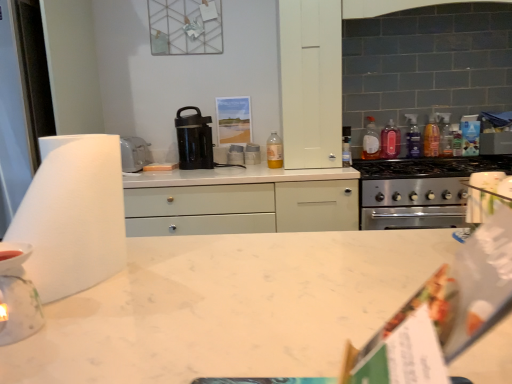
How much space does translucent plastic bottle at upper right, the 2th bottle when ordered from left to right, occupy vertically?

translucent plastic bottle at upper right, the 2th bottle when ordered from left to right, is 10.37 inches tall.

I want to click on translucent plastic bottle at upper center, positioned as the fifth bottle in right-to-left order, so click(x=274, y=151).

What do you see at coordinates (17, 296) in the screenshot? The image size is (512, 384). I see `porcelain tea light holder at lower left, which appears as the first appliance when ordered from the bottom` at bounding box center [17, 296].

The width and height of the screenshot is (512, 384). Find the location of `white glossy stack of plates at center, the first appliance from the right`. white glossy stack of plates at center, the first appliance from the right is located at coordinates (252, 154).

This screenshot has width=512, height=384. Describe the element at coordinates (390, 141) in the screenshot. I see `translucent plastic bottle at upper right, acting as the 3th bottle starting from the right` at that location.

You are a GUI agent. You are given a task and a screenshot of the screen. Output one action in this format:
    pyautogui.click(x=<x>, y=<y>)
    Task: Click on the translucent plastic bottle at upper right, the 4th bottle in the right-to-left sequence
    
    Given the screenshot: What is the action you would take?
    pyautogui.click(x=371, y=141)

Which is behind, point (414, 115) or point (25, 296)?

The point (414, 115) is behind.

Considering the relative positions of translucent plastic bottle at stove top, the 4th bottle in the left-to-right sequence, and porcelain tea light holder at lower left, which is the second appliance from right to left, in the image provided, is translucent plastic bottle at stove top, the 4th bottle in the left-to-right sequence, behind porcelain tea light holder at lower left, which is the second appliance from right to left,?

Yes, it is behind porcelain tea light holder at lower left, which is the second appliance from right to left.

Do you think translucent plastic bottle at stove top, positioned as the second bottle in right-to-left order, is within porcelain tea light holder at lower left, which is the second appliance from right to left, or outside of it?

translucent plastic bottle at stove top, positioned as the second bottle in right-to-left order, is not inside porcelain tea light holder at lower left, which is the second appliance from right to left, it's outside.

Which of these two, translucent plastic bottle at stove top, positioned as the second bottle in right-to-left order, or porcelain tea light holder at lower left, which appears as the 2th appliance when viewed from the left, is wider?

Wider between the two is porcelain tea light holder at lower left, which appears as the 2th appliance when viewed from the left.

Is stainless steel stove at right completely or partially outside of white glossy stack of plates at center, the first appliance from the right?

That's correct, stainless steel stove at right is outside of white glossy stack of plates at center, the first appliance from the right.

In the scene shown: Between stainless steel stove at right and white glossy stack of plates at center, the first appliance from the right, which one is positioned behind?

white glossy stack of plates at center, the first appliance from the right, is further away from the camera.

Which is in front, point (378, 173) or point (249, 160)?

The point (378, 173) is closer to the camera.

Can you tell me how much porcelain tea light holder at lower left, marked as the 3th appliance in a top-to-bottom arrangement, and translucent plastic bottle at stove top, the 4th bottle in the left-to-right sequence, differ in facing direction?

The angle between the facing direction of porcelain tea light holder at lower left, marked as the 3th appliance in a top-to-bottom arrangement, and the facing direction of translucent plastic bottle at stove top, the 4th bottle in the left-to-right sequence, is 89.7 degrees.

Is the surface of porcelain tea light holder at lower left, marked as the 3th appliance in a top-to-bottom arrangement, in direct contact with translucent plastic bottle at stove top, the 4th bottle in the left-to-right sequence?

porcelain tea light holder at lower left, marked as the 3th appliance in a top-to-bottom arrangement, is not next to translucent plastic bottle at stove top, the 4th bottle in the left-to-right sequence, and they're not touching.

Between point (39, 314) and point (409, 155), which one is positioned behind?

The point (409, 155) is more distant.

Looking at this image, from their relative heights in the image, would you say porcelain tea light holder at lower left, which appears as the first appliance when ordered from the bottom, is taller or shorter than translucent plastic bottle at stove top, the 4th bottle in the left-to-right sequence?

In the image, porcelain tea light holder at lower left, which appears as the first appliance when ordered from the bottom, appears to be shorter than translucent plastic bottle at stove top, the 4th bottle in the left-to-right sequence.

Can you tell me how much translucent plastic bottle at upper right, the third bottle positioned from the left, and white matte cabinet at upper center differ in facing direction?

The facing directions of translucent plastic bottle at upper right, the third bottle positioned from the left, and white matte cabinet at upper center are 0.0218 degrees apart.

The width and height of the screenshot is (512, 384). In order to click on cabinetry in front of the translucent plastic bottle at upper right, acting as the 3th bottle starting from the right in this screenshot , I will do `click(311, 82)`.

Is point (394, 143) in front of point (315, 67)?

That is False.

What's the angular difference between translucent plastic bottle at upper center, positioned as the fifth bottle in right-to-left order, and translucent plastic bottles at upper right, arranged as the 5th bottle when viewed from the left,'s facing directions?

The facing directions of translucent plastic bottle at upper center, positioned as the fifth bottle in right-to-left order, and translucent plastic bottles at upper right, arranged as the 5th bottle when viewed from the left, are 0.312 degrees apart.

Is translucent plastic bottle at upper center, positioned as the fifth bottle in right-to-left order, wider than translucent plastic bottles at upper right, marked as the first bottle in a right-to-left arrangement?

In fact, translucent plastic bottle at upper center, positioned as the fifth bottle in right-to-left order, might be narrower than translucent plastic bottles at upper right, marked as the first bottle in a right-to-left arrangement.

Is point (272, 143) positioned behind point (429, 119)?

Yes, it is.

Could you tell me if translucent plastic bottle at upper center, which is the 1th bottle from left to right, is facing translucent plastic bottles at upper right, arranged as the 5th bottle when viewed from the left?

No, translucent plastic bottle at upper center, which is the 1th bottle from left to right, is not turned towards translucent plastic bottles at upper right, arranged as the 5th bottle when viewed from the left.

Would you say porcelain tea light holder at lower left, arranged as the third appliance when viewed from the back, is inside or outside white matte paper towel at left?

porcelain tea light holder at lower left, arranged as the third appliance when viewed from the back, lies within the bounds of white matte paper towel at left.

Which point is more distant from viewer, (x=29, y=295) or (x=103, y=218)?

Point (x=103, y=218)

Is porcelain tea light holder at lower left, which is the second appliance from right to left, aimed at white matte paper towel at left?

No, porcelain tea light holder at lower left, which is the second appliance from right to left, is not oriented towards white matte paper towel at left.

What's the angular difference between porcelain tea light holder at lower left, marked as the 3th appliance in a top-to-bottom arrangement, and translucent plastic bottle at upper center, positioned as the fifth bottle in right-to-left order,'s facing directions?

89.9 degrees.

Between point (4, 273) and point (275, 142), which one is positioned in front?

The point (4, 273) is closer.

Considering the sizes of porcelain tea light holder at lower left, marked as the 3th appliance in a top-to-bottom arrangement, and translucent plastic bottle at upper center, which is the 1th bottle from left to right, in the image, is porcelain tea light holder at lower left, marked as the 3th appliance in a top-to-bottom arrangement, wider or thinner than translucent plastic bottle at upper center, which is the 1th bottle from left to right,?

porcelain tea light holder at lower left, marked as the 3th appliance in a top-to-bottom arrangement, is wider than translucent plastic bottle at upper center, which is the 1th bottle from left to right.

Identify the location of the 4th bottle to the right when counting from the porcelain tea light holder at lower left, which appears as the first appliance when ordered from the bottom. (413, 137).

The image size is (512, 384). I want to click on home appliance below the white glossy stack of plates at center, which appears as the 3th appliance when viewed from the left (from a real-world perspective), so click(x=419, y=190).

Looking at the image, which one is located closer to white plastic toaster at left, positioned as the second appliance in back-to-front order, translucent plastic bottles at upper right, marked as the first bottle in a right-to-left arrangement, or translucent plastic bottle at upper right, the 2th bottle when ordered from left to right?

translucent plastic bottle at upper right, the 2th bottle when ordered from left to right, is closer to white plastic toaster at left, positioned as the second appliance in back-to-front order.

From the image, which object appears to be farther from white matte cabinet at upper center, porcelain tea light holder at lower left, marked as the 3th appliance in a top-to-bottom arrangement, or translucent plastic bottles at upper right, arranged as the 5th bottle when viewed from the left?

porcelain tea light holder at lower left, marked as the 3th appliance in a top-to-bottom arrangement, is positioned further to the anchor white matte cabinet at upper center.

When comparing their distances from porcelain tea light holder at lower left, which appears as the first appliance when ordered from the bottom, does white matte paper towel at left or white plastic toaster at left, which is counted as the 2th appliance, starting from the front, seem closer?

Based on the image, white matte paper towel at left appears to be nearer to porcelain tea light holder at lower left, which appears as the first appliance when ordered from the bottom.

From the image, which object appears to be farther from translucent plastic bottle at upper right, the third bottle positioned from the left, translucent plastic bottles at upper right, marked as the first bottle in a right-to-left arrangement, or white matte paper towel at left?

Based on the image, white matte paper towel at left appears to be further to translucent plastic bottle at upper right, the third bottle positioned from the left.

From the image, which object appears to be farther from white matte cabinet at upper center, translucent plastic bottle at upper right, the 2th bottle when ordered from left to right, or porcelain tea light holder at lower left, arranged as the third appliance when viewed from the back?

porcelain tea light holder at lower left, arranged as the third appliance when viewed from the back, is further to white matte cabinet at upper center.

Looking at the image, which one is located closer to translucent plastic bottles at upper right, arranged as the 5th bottle when viewed from the left, white glossy stack of plates at center, the first appliance from the right, or translucent plastic bottle at stove top, positioned as the second bottle in right-to-left order?

translucent plastic bottle at stove top, positioned as the second bottle in right-to-left order.

Estimate the real-world distances between objects in this image. Which object is further from white matte paper towel at left, stainless steel stove at right or translucent plastic bottle at upper right, acting as the 3th bottle starting from the right?

Among the two, translucent plastic bottle at upper right, acting as the 3th bottle starting from the right, is located further to white matte paper towel at left.

Based on their spatial positions, is white plastic toaster at left, which is the 2th appliance in top-to-bottom order, or translucent plastic bottle at upper right, the 2th bottle when ordered from left to right, closer to white glossy stack of plates at center, the first appliance viewed from the back?

Based on the image, white plastic toaster at left, which is the 2th appliance in top-to-bottom order, appears to be nearer to white glossy stack of plates at center, the first appliance viewed from the back.

The image size is (512, 384). In order to click on bottle situated between black plastic coffee maker at center and translucent plastic bottle at upper right, the 2th bottle when ordered from left to right, from left to right in this screenshot , I will do `click(274, 151)`.

Find the location of a particular element. Image resolution: width=512 pixels, height=384 pixels. paper towel between porcelain tea light holder at lower left, which is the second appliance from right to left, and white matte cabinet at upper center from front to back is located at coordinates (73, 215).

Image resolution: width=512 pixels, height=384 pixels. What are the coordinates of `appliance located between porcelain tea light holder at lower left, which is the second appliance from right to left, and translucent plastic bottle at upper right, the third bottle positioned from the left, in the depth direction` in the screenshot? It's located at (134, 154).

In order to click on cabinetry between porcelain tea light holder at lower left, arranged as the third appliance when viewed from the back, and black plastic coffee maker at center, along the z-axis in this screenshot , I will do `click(311, 82)`.